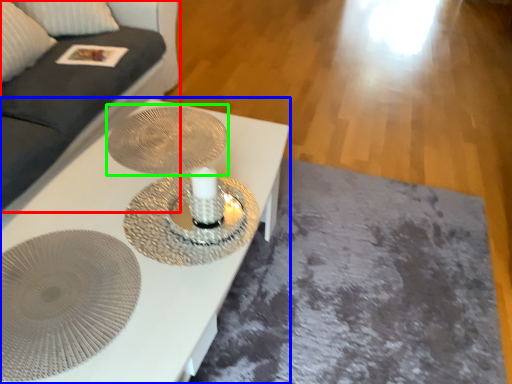
Question: Which is farther away from couch (highlighted by a red box)? table (highlighted by a blue box) or oval (highlighted by a green box)?

Choices:
 (A) table
 (B) oval

Answer: (A)